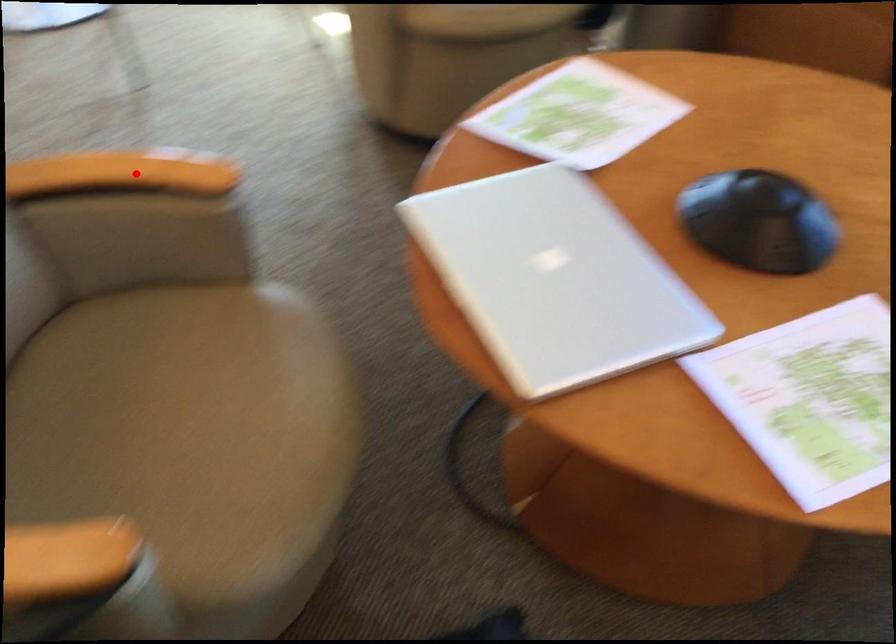
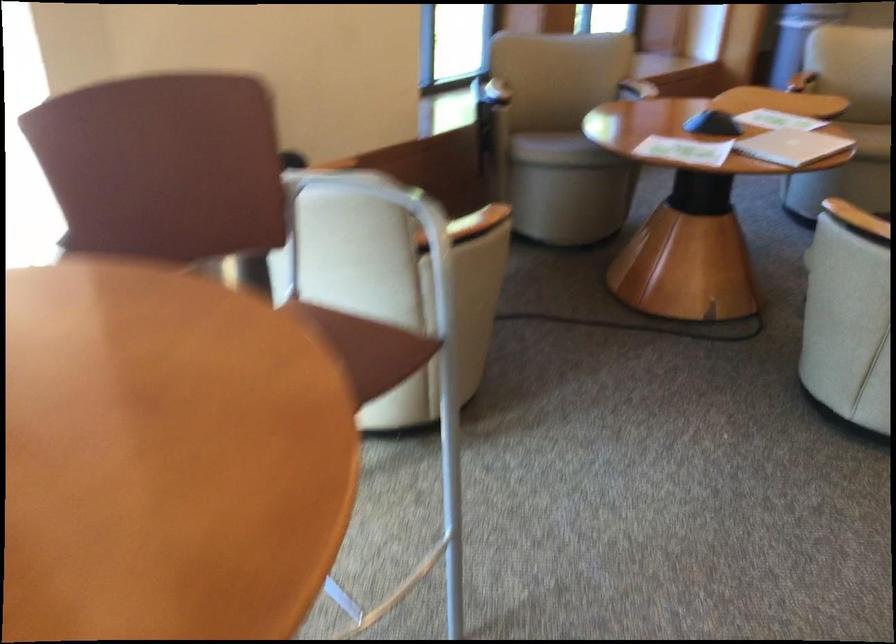
Question: I am providing you with two images of the same scene from different viewpoints. In image1, a red point is highlighted. Considering the same 3D point in image2, which of the following is correct?

Choices:
 (A) It is closer
 (B) It is farther

Answer: (B)